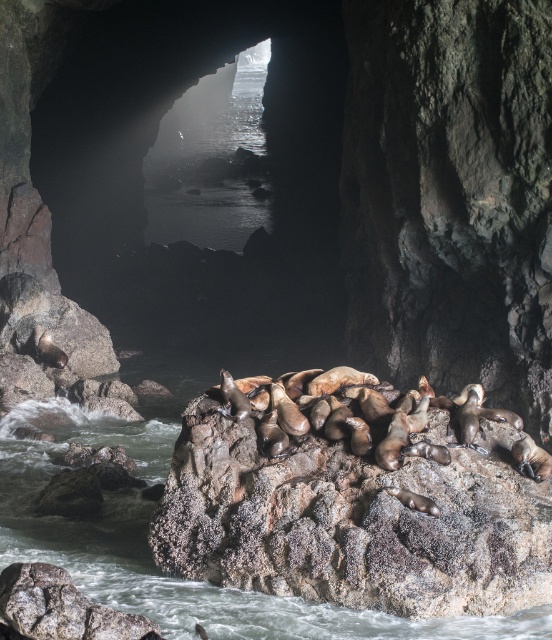
You are a hiker exploring the cave and want to place a 3D printed model of a sea lion on the largest rock in the scene. Which rock should you choose between the smooth rock cave at center and the brown rough rock at center?

The smooth rock cave at center is bigger than the brown rough rock at center, so you should choose the smooth rock cave at center to place the 3D printed model of a sea lion.